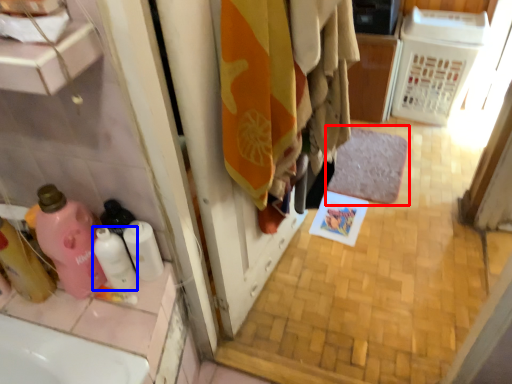
Question: Among these objects, which one is nearest to the camera, bath mat (highlighted by a red box) or cleaning product (highlighted by a blue box)?

Choices:
 (A) bath mat
 (B) cleaning product

Answer: (B)